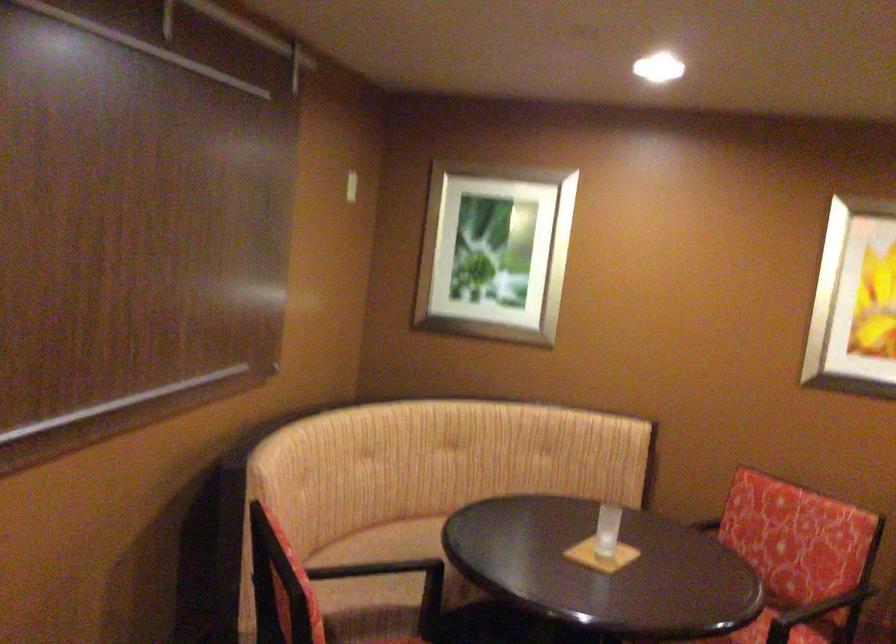
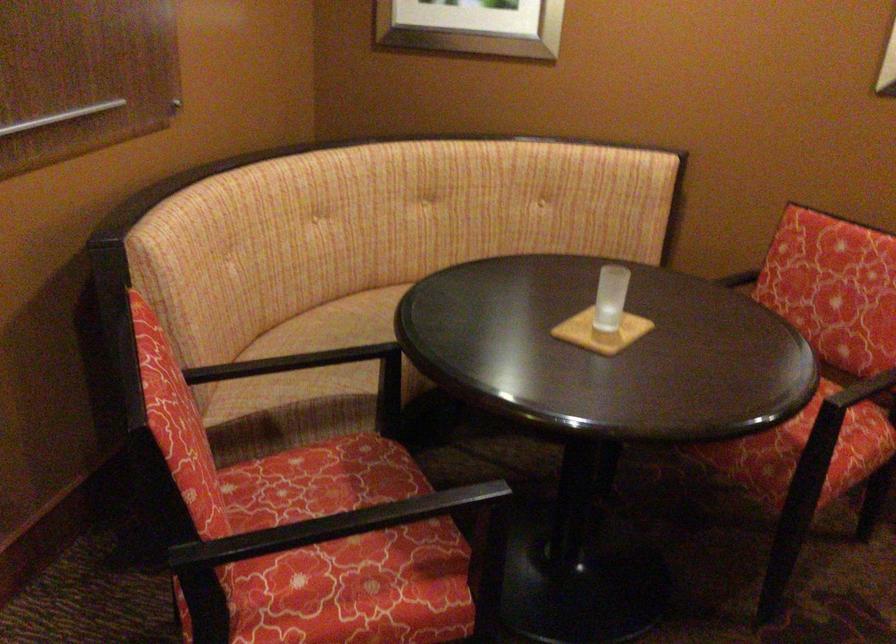
Where in the second image is the point corresponding to (x=708, y=533) from the first image?

(738, 279)